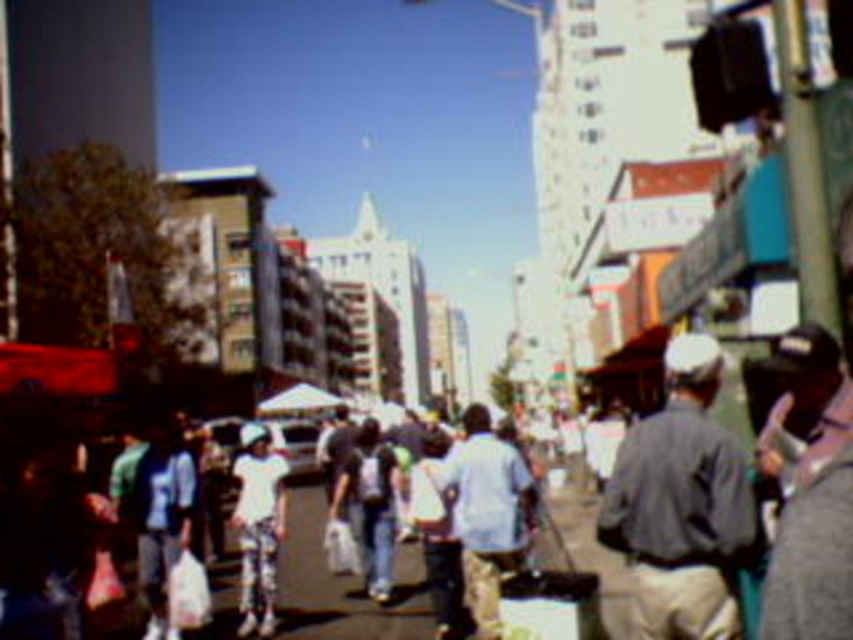
You are a photographer standing on the bustling urban street scene. You want to take a photo of the gray fabric shirt at center and the white matte pants at center. Which clothing item appears narrower in the photo?

The gray fabric shirt at center appears narrower in the photo because it is thinner than the white matte pants at center.